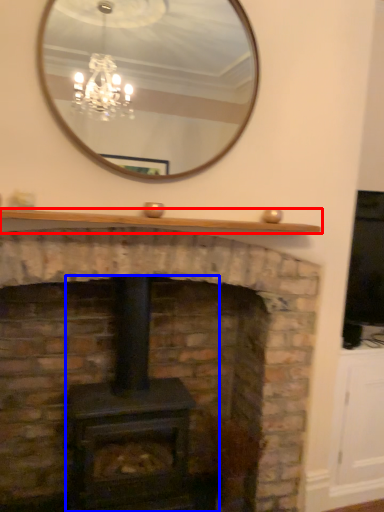
Question: Among these objects, which one is farthest to the camera, mantle (highlighted by a red box) or wood burning stove (highlighted by a blue box)?

Choices:
 (A) mantle
 (B) wood burning stove

Answer: (B)